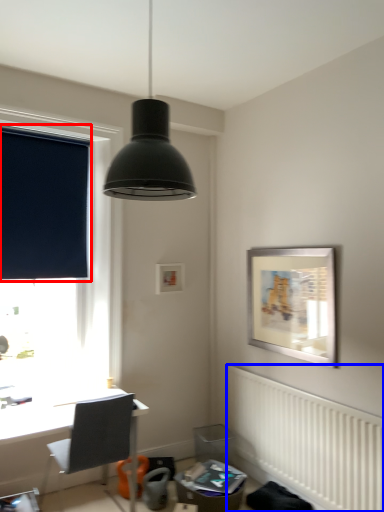
Question: Which point is closer to the camera, window screen (highlighted by a red box) or radiator (highlighted by a blue box)?

Choices:
 (A) window screen
 (B) radiator

Answer: (B)